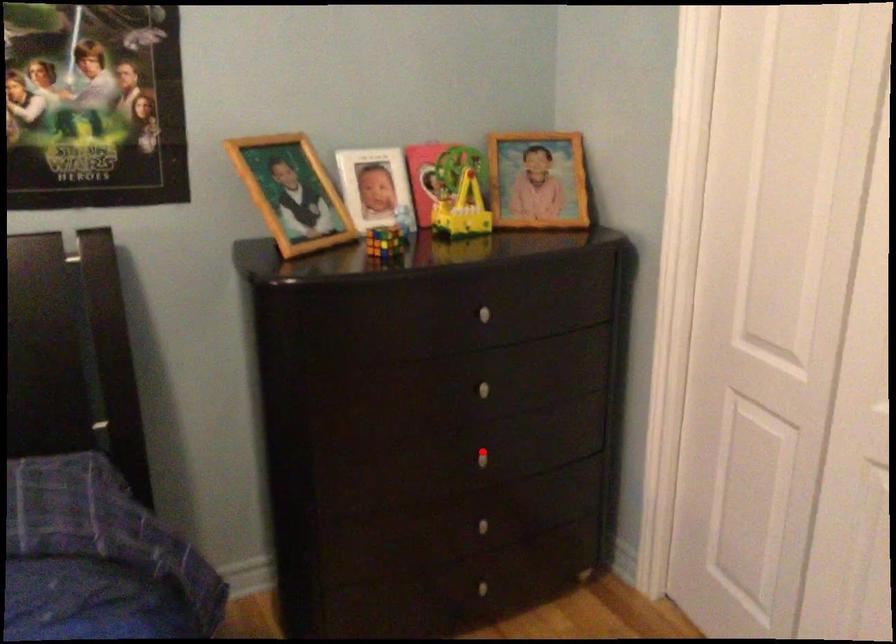
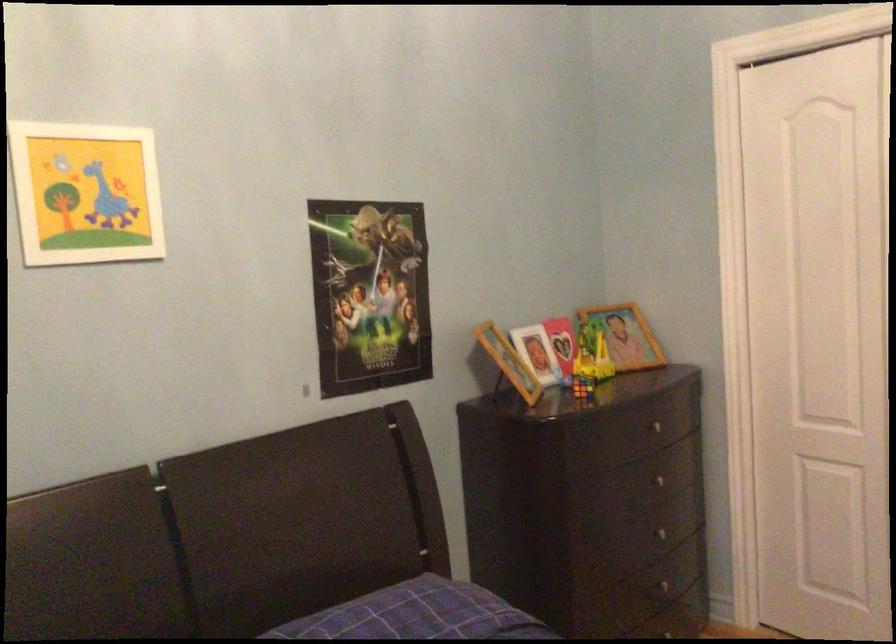
Where in the second image is the point corresponding to the highlighted location from the first image?

(667, 532)